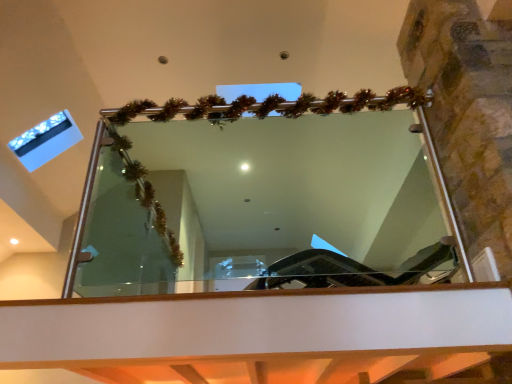
Question: Is clear glass mirror at center bigger than transparent glass window at upper left?

Choices:
 (A) no
 (B) yes

Answer: (B)

Question: Would you consider clear glass mirror at center to be distant from transparent glass window at upper left?

Choices:
 (A) no
 (B) yes

Answer: (B)

Question: Can you confirm if clear glass mirror at center is shorter than transparent glass window at upper left?

Choices:
 (A) yes
 (B) no

Answer: (B)

Question: Is clear glass mirror at center taller than transparent glass window at upper left?

Choices:
 (A) no
 (B) yes

Answer: (B)

Question: Is clear glass mirror at center closer to the viewer compared to transparent glass window at upper left?

Choices:
 (A) no
 (B) yes

Answer: (B)

Question: Is clear glass mirror at center to the left of transparent glass window at upper left from the viewer's perspective?

Choices:
 (A) no
 (B) yes

Answer: (A)

Question: Is transparent glass window at upper left facing away from clear glass mirror at center?

Choices:
 (A) no
 (B) yes

Answer: (A)

Question: Considering the relative sizes of transparent glass window at upper left and clear glass mirror at center in the image provided, is transparent glass window at upper left bigger than clear glass mirror at center?

Choices:
 (A) yes
 (B) no

Answer: (B)

Question: From a real-world perspective, is transparent glass window at upper left physically below clear glass mirror at center?

Choices:
 (A) no
 (B) yes

Answer: (A)

Question: Is there a large distance between transparent glass window at upper left and clear glass mirror at center?

Choices:
 (A) no
 (B) yes

Answer: (B)

Question: From a real-world perspective, is transparent glass window at upper left over clear glass mirror at center?

Choices:
 (A) no
 (B) yes

Answer: (B)

Question: Is transparent glass window at upper left closer to the viewer compared to clear glass mirror at center?

Choices:
 (A) yes
 (B) no

Answer: (B)

Question: Is transparent glass window at upper left inside or outside of clear glass mirror at center?

Choices:
 (A) inside
 (B) outside

Answer: (B)